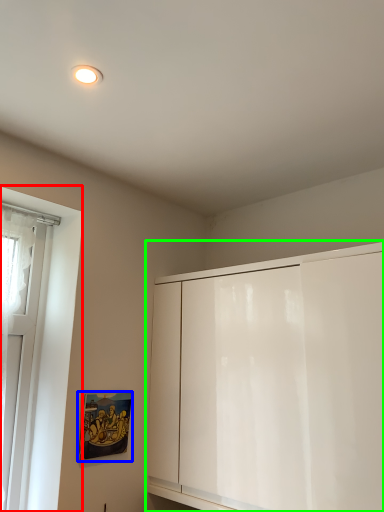
Question: Based on their relative distances, which object is nearer to window (highlighted by a red box)? Choose from picture frame (highlighted by a blue box) and cabinetry (highlighted by a green box).

Choices:
 (A) picture frame
 (B) cabinetry

Answer: (A)